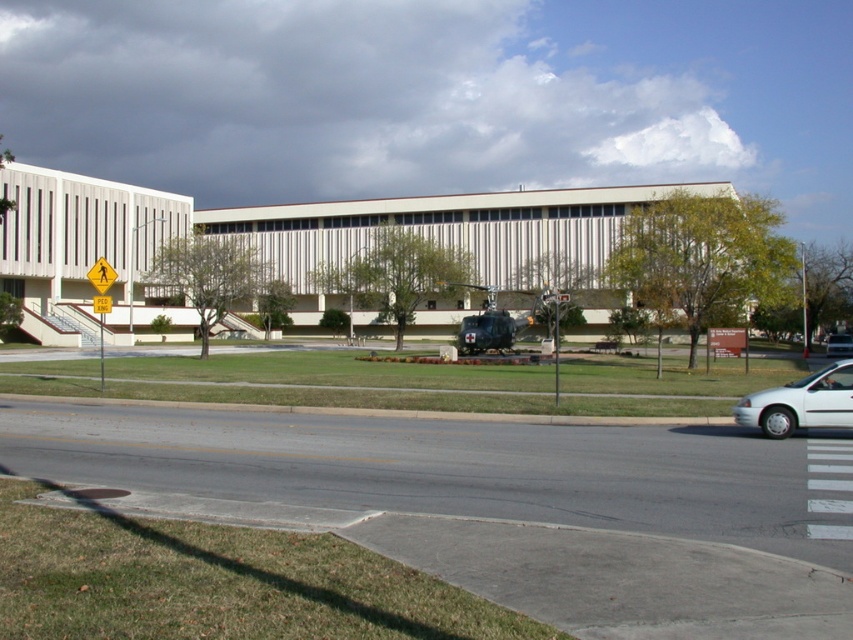
You are a delivery person standing at the entrance of the building. You need to load packages into the white matte van at lower right. Which direction should you walk to reach the van?

The white matte van at lower right is located at point 0.630 on the x axis and 0.940 on the y axis. Since the van is at the lower right, you should walk towards the right and slightly downward from the entrance to reach it.

You are a pedestrian waiting at the crosswalk. You see the yellow reflective pedestrian crossing sign at upper center and the white matte sedan at center. Which object is higher in the image?

The yellow reflective pedestrian crossing sign at upper center is located above the white matte sedan at center, so it is higher in the image.

You are a pedestrian standing at the crosswalk on the paved road. You see a white matte van at lower right and a white matte sedan at center. Which vehicle is closer to the left side of the road?

The white matte van at lower right is to the left of the white matte sedan at center, so the white matte van at lower right is closer to the left side of the road.